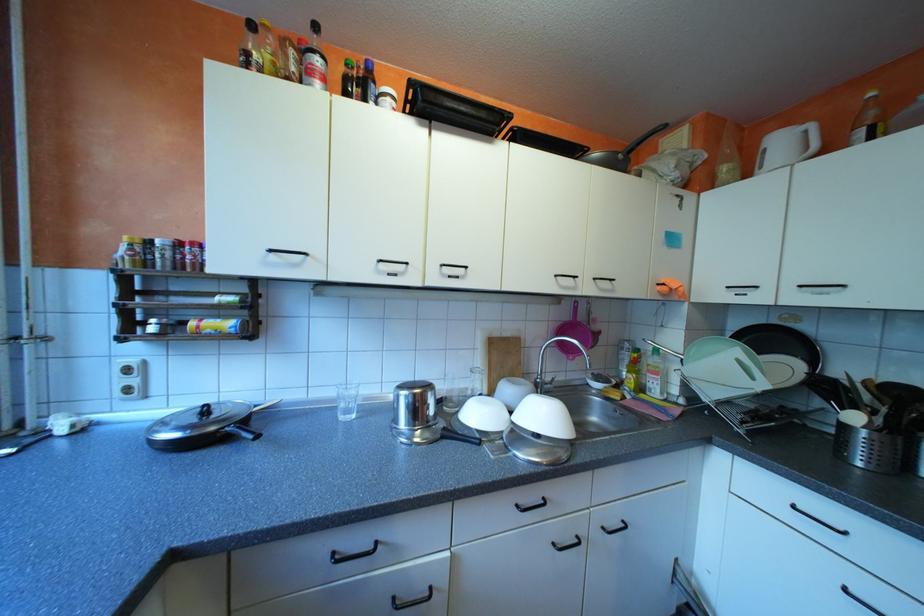
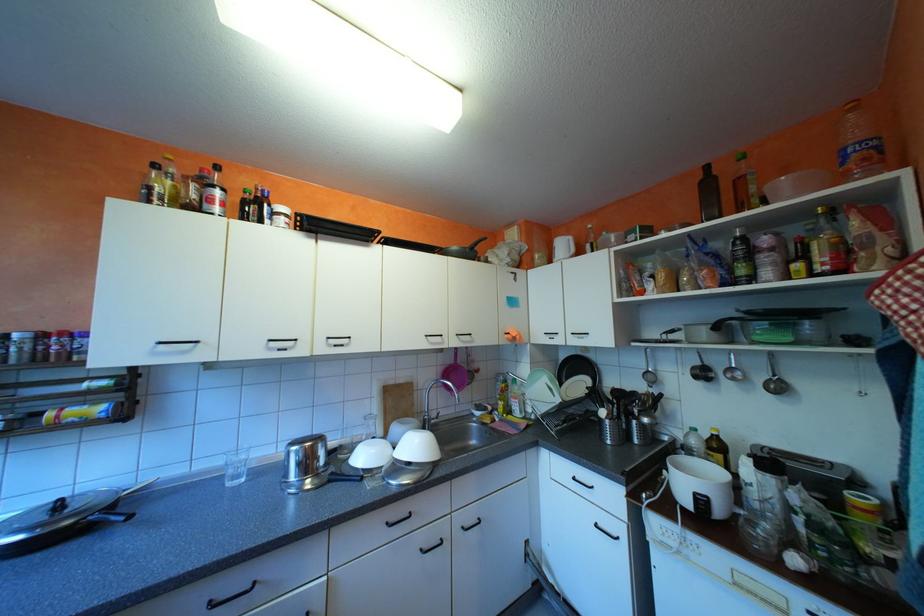
Locate, in the second image, the point that corresponds to [614,527] in the first image.

(475, 527)